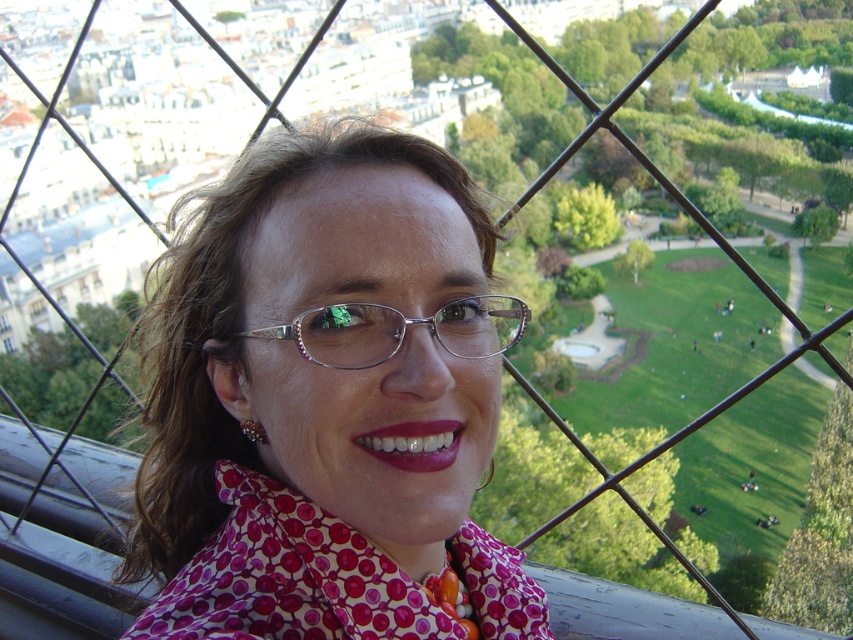
Question: Can you confirm if pink dotted shirt at center is positioned above metallic silver glasses at center?

Choices:
 (A) yes
 (B) no

Answer: (B)

Question: Which point appears farthest from the camera in this image?

Choices:
 (A) (515, 310)
 (B) (248, 324)

Answer: (A)

Question: Does pink dotted shirt at center have a smaller size compared to metallic silver glasses at center?

Choices:
 (A) yes
 (B) no

Answer: (B)

Question: Does pink dotted shirt at center appear on the right side of metallic silver glasses at center?

Choices:
 (A) yes
 (B) no

Answer: (B)